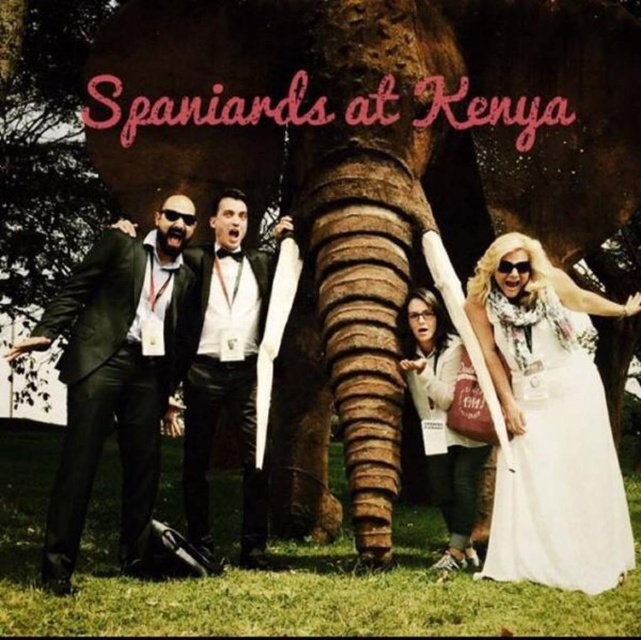
Does white satin dress at right appear under black matte suit at left?

Yes, white satin dress at right is below black matte suit at left.

Is white satin dress at right positioned at the back of black matte suit at left?

No, white satin dress at right is in front of black matte suit at left.

Is point (510, 564) farther from camera compared to point (160, 320)?

No, it is in front of (160, 320).

At what (x,y) coordinates should I click in order to perform the action: click on white satin dress at right. Please return your answer as a coordinate pair (x, y). The height and width of the screenshot is (640, 641). Looking at the image, I should click on (549, 422).

Who is more distant from viewer, (126,474) or (469,548)?

Point (469,548)

Describe the element at coordinates (117, 392) in the screenshot. I see `black matte suit at left` at that location.

Identify the location of black matte suit at left. The image size is (641, 640). (117, 392).

Locate an element on the screen. The image size is (641, 640). white satin dress at right is located at coordinates (549, 422).